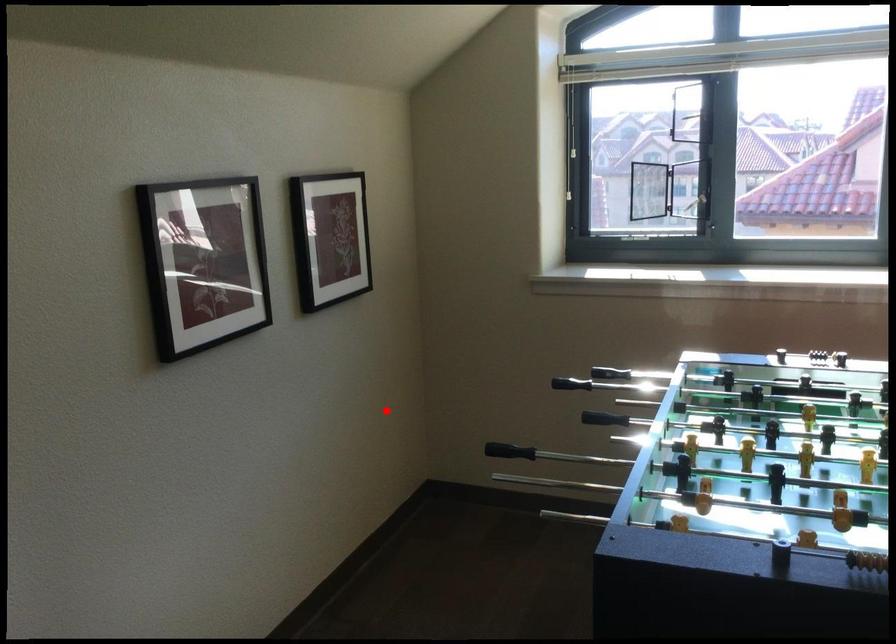
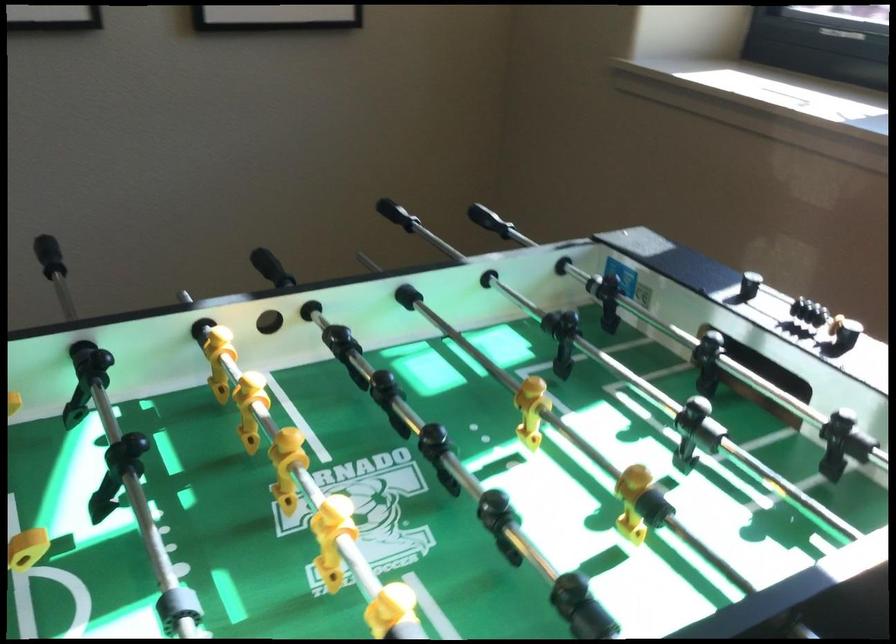
Where in the second image is the point corresponding to the highlighted location from the first image?

(397, 214)